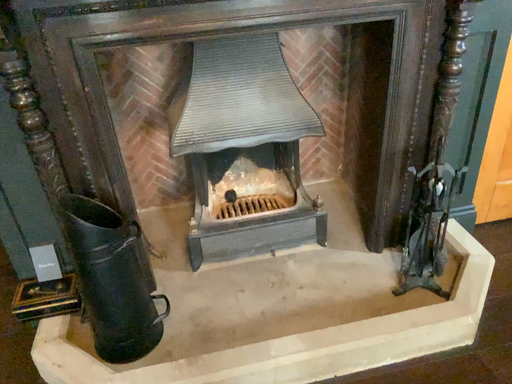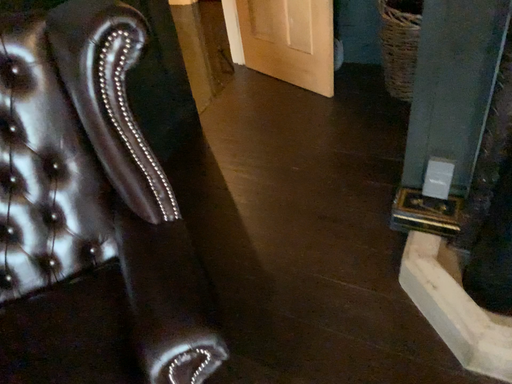
Question: How did the camera likely rotate when shooting the video?

Choices:
 (A) rotated left
 (B) rotated right

Answer: (A)